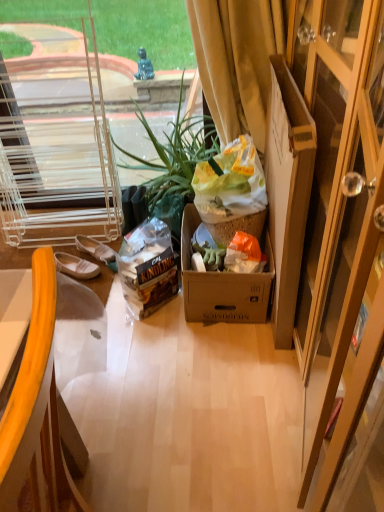
Question: Does yellow plastic chair at left have a greater height compared to cardboard box at right?

Choices:
 (A) yes
 (B) no

Answer: (B)

Question: From the image's perspective, would you say yellow plastic chair at left is positioned over cardboard box at right?

Choices:
 (A) no
 (B) yes

Answer: (A)

Question: Is yellow plastic chair at left oriented towards cardboard box at right?

Choices:
 (A) no
 (B) yes

Answer: (A)

Question: From a real-world perspective, is yellow plastic chair at left over cardboard box at right?

Choices:
 (A) yes
 (B) no

Answer: (A)

Question: Is yellow plastic chair at left thinner than cardboard box at right?

Choices:
 (A) no
 (B) yes

Answer: (A)

Question: Is green leafy plant at center wider or thinner than white fabric shoe at left?

Choices:
 (A) wide
 (B) thin

Answer: (A)

Question: Is green leafy plant at center to the left or to the right of white fabric shoe at left in the image?

Choices:
 (A) left
 (B) right

Answer: (B)

Question: From the image's perspective, relative to white fabric shoe at left, is green leafy plant at center above or below?

Choices:
 (A) below
 (B) above

Answer: (B)

Question: Is green leafy plant at center taller or shorter than white fabric shoe at left?

Choices:
 (A) tall
 (B) short

Answer: (A)

Question: Would you say cardboard box at right is to the left or to the right of white fabric shoe at left in the picture?

Choices:
 (A) right
 (B) left

Answer: (A)

Question: Considering the positions of cardboard box at right and white fabric shoe at left in the image, is cardboard box at right bigger or smaller than white fabric shoe at left?

Choices:
 (A) big
 (B) small

Answer: (A)

Question: From the image's perspective, is cardboard box at right positioned above or below white fabric shoe at left?

Choices:
 (A) above
 (B) below

Answer: (A)

Question: Is cardboard box at right situated inside white fabric shoe at left or outside?

Choices:
 (A) inside
 (B) outside

Answer: (B)

Question: From the image's perspective, is yellow velvet curtain at upper right located above or below white fabric shoe at left?

Choices:
 (A) below
 (B) above

Answer: (B)

Question: Choose the correct answer: Is yellow velvet curtain at upper right inside white fabric shoe at left or outside it?

Choices:
 (A) outside
 (B) inside

Answer: (A)